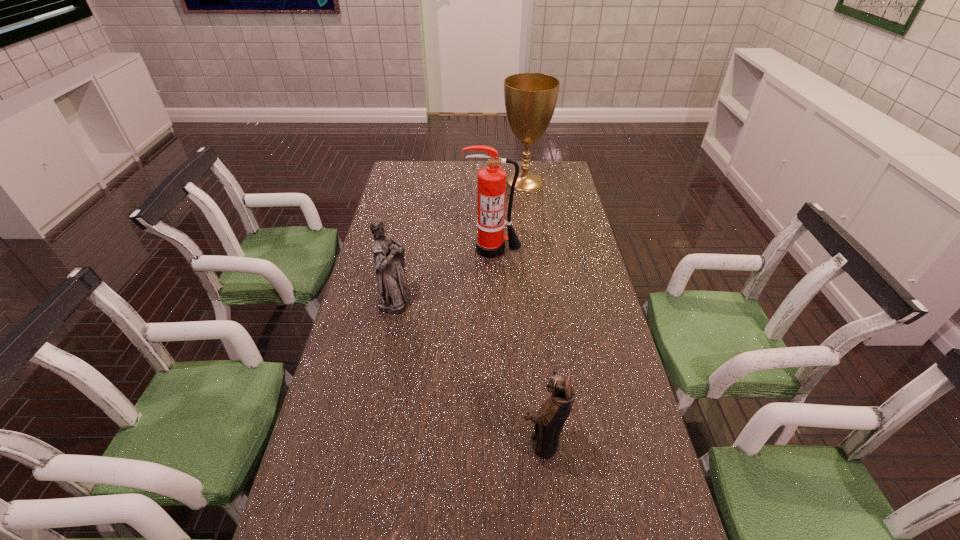
Where is `free point located on the front-facing side of the nearer figurine`? free point located on the front-facing side of the nearer figurine is located at coordinates (487, 441).

Find the location of a particular element. The image size is (960, 540). blank area located 0.360m on the front-facing side of the nearer figurine is located at coordinates (370, 441).

Where is `object present at the far edge`? object present at the far edge is located at coordinates (530, 98).

The width and height of the screenshot is (960, 540). Identify the location of object that is at the left edge. (393, 289).

Identify the location of object that is at the right edge. The height and width of the screenshot is (540, 960). (530, 98).

Locate an element on the screen. This screenshot has width=960, height=540. object situated at the far right corner is located at coordinates (530, 98).

The height and width of the screenshot is (540, 960). Identify the location of free space at the left edge of the desktop. (418, 202).

This screenshot has height=540, width=960. In order to click on vacant space at the right edge of the desktop in this screenshot , I will do `click(603, 401)`.

Where is `blank space at the far left corner of the desktop`? Image resolution: width=960 pixels, height=540 pixels. blank space at the far left corner of the desktop is located at coordinates (407, 166).

This screenshot has width=960, height=540. I want to click on vacant space at the far right corner, so click(x=540, y=171).